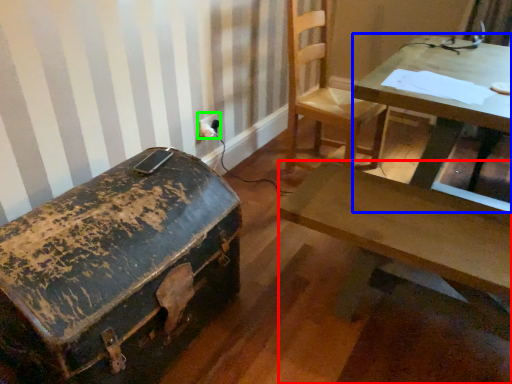
Question: Estimate the real-world distances between objects in this image. Which object is farther from desk (highlighted by a red box), table (highlighted by a blue box) or electric outlet (highlighted by a green box)?

Choices:
 (A) table
 (B) electric outlet

Answer: (B)